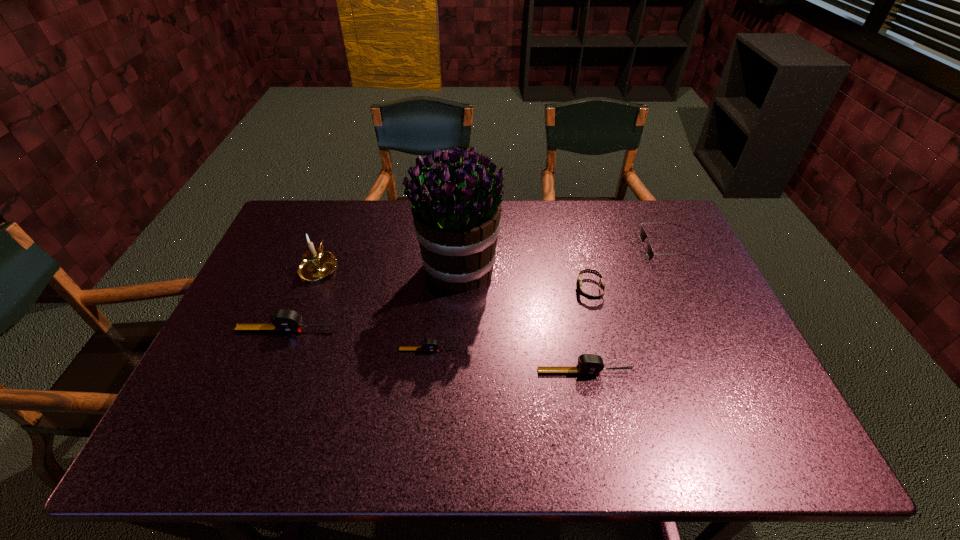
Locate an element on the screen. the farthest tape measure is located at coordinates (282, 320).

You are a GUI agent. You are given a task and a screenshot of the screen. Output one action in this format:
    pyautogui.click(x=<x>, y=<y>)
    Task: Click on the third nearest object
    This screenshot has height=540, width=960.
    Given the screenshot: What is the action you would take?
    pyautogui.click(x=282, y=320)

Where is `the second nearest object`? Image resolution: width=960 pixels, height=540 pixels. the second nearest object is located at coordinates (429, 345).

Find the location of a particular element. Image resolution: width=960 pixels, height=540 pixels. the second nearest tape measure is located at coordinates coord(429,345).

What are the coordinates of `the nearest tape measure` in the screenshot? It's located at (588, 364).

Find the location of `the fourth shortest object`. the fourth shortest object is located at coordinates (588, 364).

You are a GUI agent. You are given a task and a screenshot of the screen. Output one action in this format:
    pyautogui.click(x=<x>, y=<y>)
    Task: Click on the bouquet
    The width and height of the screenshot is (960, 540).
    Given the screenshot: What is the action you would take?
    pyautogui.click(x=456, y=215)

Find the location of a particular element. the sixth shortest object is located at coordinates (317, 264).

Where is `watch`? This screenshot has height=540, width=960. watch is located at coordinates 579,281.

The width and height of the screenshot is (960, 540). Identify the location of sunglasses. (642, 234).